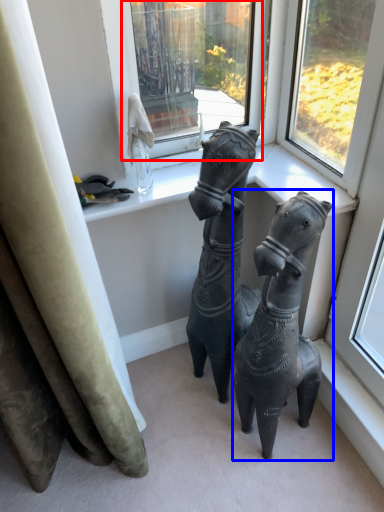
Question: Which object is closer to the camera taking this photo, window (highlighted by a red box) or horse (highlighted by a blue box)?

Choices:
 (A) window
 (B) horse

Answer: (B)